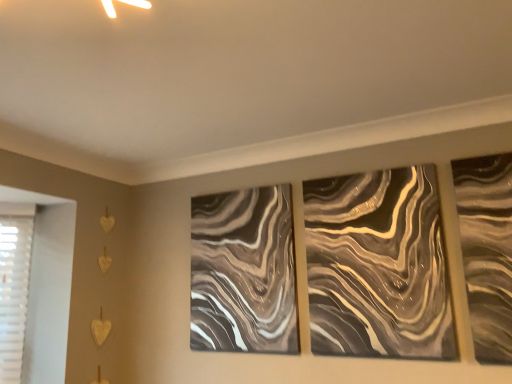
Question: Is point (243, 243) closer or farther from the camera than point (359, 339)?

Choices:
 (A) closer
 (B) farther

Answer: (B)

Question: From the image's perspective, is metallic swirl art at center, the first design from the left, positioned above or below metallic swirl art at center-right, acting as the first design starting from the right?

Choices:
 (A) below
 (B) above

Answer: (A)

Question: Is metallic swirl art at center, positioned as the second design in right-to-left order, spatially inside metallic swirl art at center-right, acting as the first design starting from the right, or outside of it?

Choices:
 (A) outside
 (B) inside

Answer: (A)

Question: Looking at their shapes, would you say metallic swirl art at center-right, acting as the first design starting from the right, is wider or thinner than metallic swirl art at center, the first design from the left?

Choices:
 (A) wide
 (B) thin

Answer: (B)

Question: Considering the relative positions of metallic swirl art at center-right, the 2th design from the left, and metallic swirl art at center, positioned as the second design in right-to-left order, in the image provided, is metallic swirl art at center-right, the 2th design from the left, to the left or to the right of metallic swirl art at center, positioned as the second design in right-to-left order,?

Choices:
 (A) left
 (B) right

Answer: (B)

Question: Is metallic swirl art at center-right, acting as the first design starting from the right, bigger or smaller than metallic swirl art at center, positioned as the second design in right-to-left order?

Choices:
 (A) big
 (B) small

Answer: (B)

Question: Relative to metallic swirl art at center, positioned as the second design in right-to-left order, is metallic swirl art at center-right, acting as the first design starting from the right, in front or behind?

Choices:
 (A) front
 (B) behind

Answer: (A)